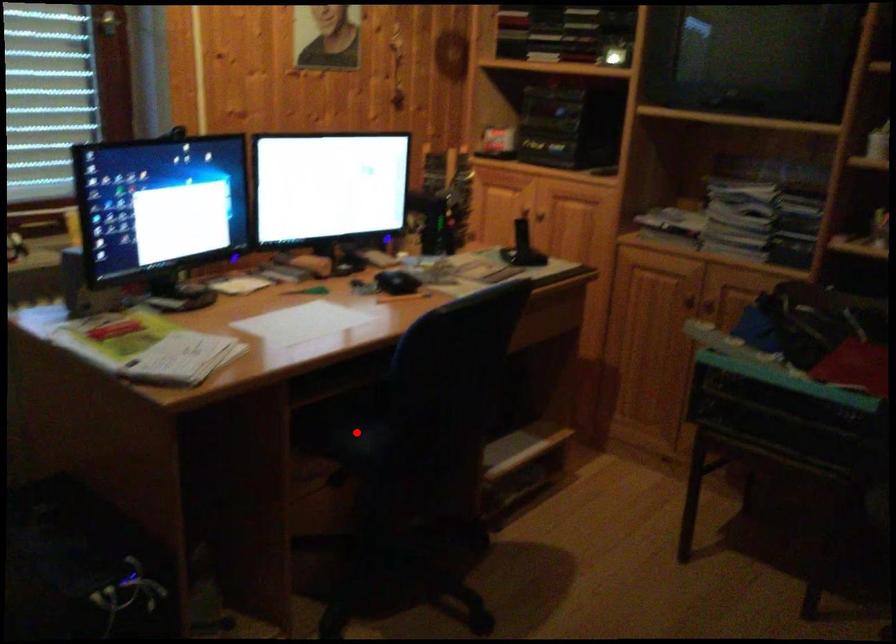
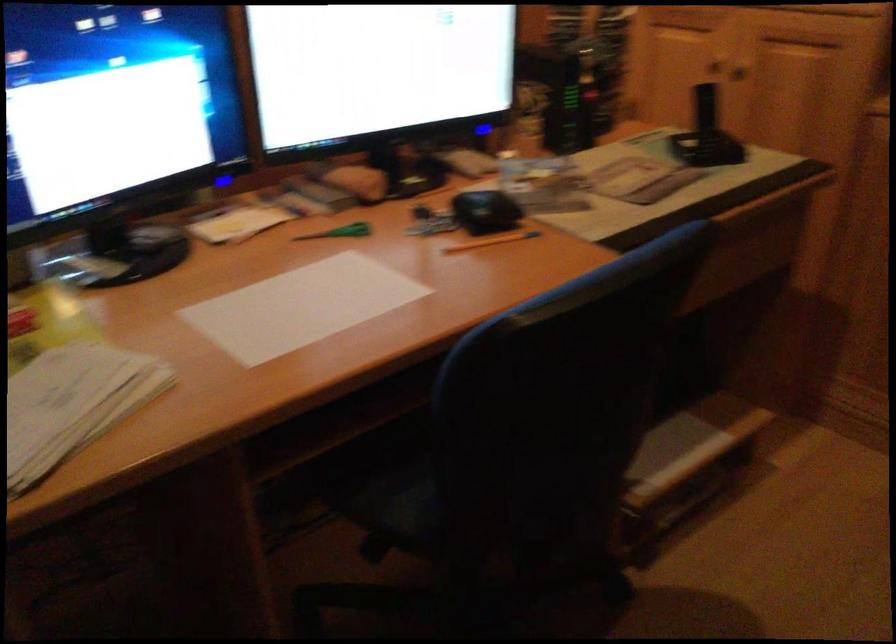
Question: I am providing you with two images of the same scene from different viewpoints. Image1 has a red point marked. In image2, the corresponding 3D location appears at what relative position? Reply with the corresponding letter.

Choices:
 (A) Closer
 (B) Farther

Answer: (A)